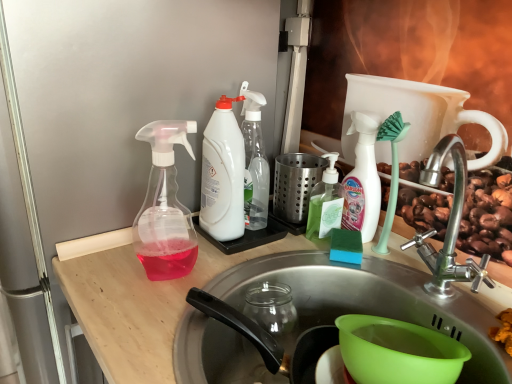
Locate an element on the screen. This screenshot has width=512, height=384. vacant space to the right of white plastic bottle at center, arranged as the 2th bottle when viewed from the left is located at coordinates (294, 238).